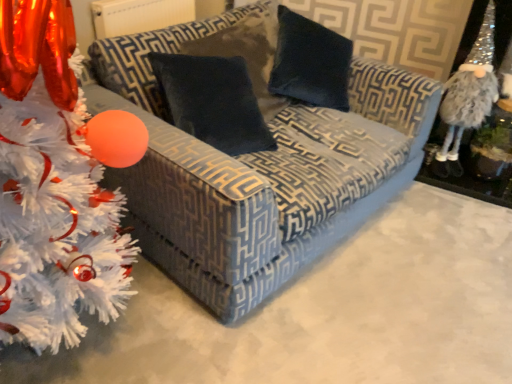
Measure the distance between point (225, 80) and camera.

Point (225, 80) is 5.21 feet from camera.

Where is `velvet dark blue pillow at center`? The image size is (512, 384). velvet dark blue pillow at center is located at coordinates (212, 101).

Considering the sizes of objects velvet dark blue pillow at center and velvet-patterned couch at center in the image provided, who is smaller, velvet dark blue pillow at center or velvet-patterned couch at center?

velvet dark blue pillow at center.

Between velvet dark blue pillow at center and velvet-patterned couch at center, which one appears on the right side from the viewer's perspective?

From the viewer's perspective, velvet-patterned couch at center appears more on the right side.

Consider the image. Can you confirm if velvet dark blue pillow at center is shorter than velvet-patterned couch at center?

Correct, velvet dark blue pillow at center is not as tall as velvet-patterned couch at center.

Is velvet dark blue pillow at center further to the viewer compared to velvet-patterned couch at center?

Yes, the depth of velvet dark blue pillow at center is greater than that of velvet-patterned couch at center.

Is white fluffy christmas tree at left completely or partially outside of velvet-patterned couch at center?

Yes, white fluffy christmas tree at left is outside of velvet-patterned couch at center.

Which object is positioned more to the right, white fluffy christmas tree at left or velvet-patterned couch at center?

velvet-patterned couch at center.

Does white fluffy christmas tree at left have a smaller size compared to velvet-patterned couch at center?

Correct, white fluffy christmas tree at left occupies less space than velvet-patterned couch at center.

Can you confirm if white fluffy christmas tree at left is taller than velvet-patterned couch at center?

Indeed, white fluffy christmas tree at left has a greater height compared to velvet-patterned couch at center.

Which object is wider, velvet-patterned couch at center or fuzzy silver gnome at right?

velvet-patterned couch at center.

Is fuzzy silver gnome at right located within velvet-patterned couch at center?

No, fuzzy silver gnome at right is not surrounded by velvet-patterned couch at center.

From a real-world perspective, is velvet-patterned couch at center under fuzzy silver gnome at right?

Correct, in the physical world, velvet-patterned couch at center is lower than fuzzy silver gnome at right.

How far apart are velvet-patterned couch at center and fuzzy silver gnome at right?

30.03 inches.

Can you confirm if velvet dark blue pillow at center is smaller than fuzzy silver gnome at right?

No, velvet dark blue pillow at center is not smaller than fuzzy silver gnome at right.

In terms of width, does velvet dark blue pillow at center look wider or thinner when compared to fuzzy silver gnome at right?

Considering their sizes, velvet dark blue pillow at center looks broader than fuzzy silver gnome at right.

What's the angular difference between velvet dark blue pillow at center and fuzzy silver gnome at right's facing directions?

They differ by 73.4 degrees in their facing directions.

The image size is (512, 384). Find the location of `christmas tree to the left of fuzzy silver gnome at right`. christmas tree to the left of fuzzy silver gnome at right is located at coordinates (52, 188).

Are white fluffy christmas tree at left and fuzzy silver gnome at right located far from each other?

white fluffy christmas tree at left is far away from fuzzy silver gnome at right.

Choose the correct answer: Is white fluffy christmas tree at left inside fuzzy silver gnome at right or outside it?

The correct answer is: outside.

Is velvet dark blue pillow at center in front of white fluffy christmas tree at left?

No, velvet dark blue pillow at center is further to the viewer.

From a real-world perspective, is velvet dark blue pillow at center under white fluffy christmas tree at left?

Incorrect, from a real-world perspective, velvet dark blue pillow at center is higher than white fluffy christmas tree at left.

Is velvet dark blue pillow at center spatially inside white fluffy christmas tree at left, or outside of it?

velvet dark blue pillow at center cannot be found inside white fluffy christmas tree at left.

Is velvet dark blue pillow at center taller than white fluffy christmas tree at left?

Incorrect, the height of velvet dark blue pillow at center is not larger of that of white fluffy christmas tree at left.

From the image's perspective, which is below, velvet-patterned couch at center or velvet dark blue pillow at center?

velvet-patterned couch at center is shown below in the image.

From a real-world perspective, is velvet-patterned couch at center under velvet dark blue pillow at center?

Indeed, from a real-world perspective, velvet-patterned couch at center is positioned beneath velvet dark blue pillow at center.

Considering the positions of objects velvet-patterned couch at center and velvet dark blue pillow at center in the image provided, who is more to the right, velvet-patterned couch at center or velvet dark blue pillow at center?

From the viewer's perspective, velvet-patterned couch at center appears more on the right side.

From the picture: Does velvet-patterned couch at center turn towards velvet dark blue pillow at center?

Yes, velvet-patterned couch at center is aimed at velvet dark blue pillow at center.

In order to click on pillow on the left of velvet-patterned couch at center in this screenshot , I will do `click(212, 101)`.

Locate an element on the screen. The height and width of the screenshot is (384, 512). christmas tree in front of the velvet-patterned couch at center is located at coordinates (52, 188).

Which object lies further to the anchor point velvet-patterned couch at center, velvet dark blue pillow at center or fuzzy silver gnome at right?

fuzzy silver gnome at right is further to velvet-patterned couch at center.

Based on their spatial positions, is white fluffy christmas tree at left or fuzzy silver gnome at right closer to velvet-patterned couch at center?

Based on the image, white fluffy christmas tree at left appears to be nearer to velvet-patterned couch at center.

Which object lies further to the anchor point velvet-patterned couch at center, fuzzy silver gnome at right or white fluffy christmas tree at left?

fuzzy silver gnome at right is positioned further to the anchor velvet-patterned couch at center.

Which object lies nearer to the anchor point velvet-patterned couch at center, white fluffy christmas tree at left or velvet dark blue pillow at center?

velvet dark blue pillow at center is positioned closer to the anchor velvet-patterned couch at center.

Estimate the real-world distances between objects in this image. Which object is closer to velvet dark blue pillow at center, white fluffy christmas tree at left or fuzzy silver gnome at right?

Among the two, white fluffy christmas tree at left is located nearer to velvet dark blue pillow at center.

Based on their spatial positions, is velvet-patterned couch at center or fuzzy silver gnome at right further from velvet dark blue pillow at center?

Among the two, fuzzy silver gnome at right is located further to velvet dark blue pillow at center.

Based on their spatial positions, is fuzzy silver gnome at right or velvet-patterned couch at center closer to velvet dark blue pillow at center?

velvet-patterned couch at center is closer to velvet dark blue pillow at center.

Looking at this image, which object lies nearer to the anchor point white fluffy christmas tree at left, velvet dark blue pillow at center or fuzzy silver gnome at right?

velvet dark blue pillow at center is closer to white fluffy christmas tree at left.

Locate an element on the screen. This screenshot has width=512, height=384. studio couch positioned between white fluffy christmas tree at left and velvet dark blue pillow at center from near to far is located at coordinates (257, 171).

Locate an element on the screen. Image resolution: width=512 pixels, height=384 pixels. studio couch situated between velvet dark blue pillow at center and fuzzy silver gnome at right from left to right is located at coordinates (257, 171).

At what (x,y) coordinates should I click in order to perform the action: click on pillow between white fluffy christmas tree at left and fuzzy silver gnome at right from left to right. Please return your answer as a coordinate pair (x, y). Looking at the image, I should click on (212, 101).

Identify the location of studio couch between white fluffy christmas tree at left and fuzzy silver gnome at right. The width and height of the screenshot is (512, 384). (257, 171).